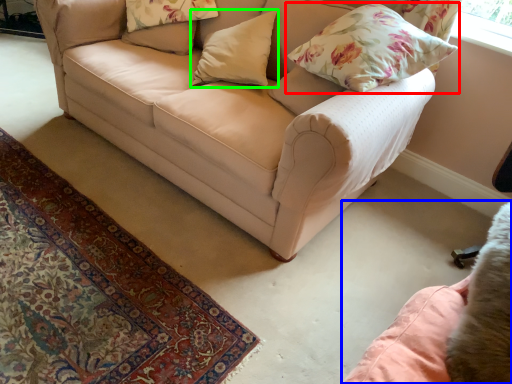
Question: Which object is positioned farthest from pillow (highlighted by a red box)? Select from swivel chair (highlighted by a blue box) and pillow (highlighted by a green box).

Choices:
 (A) swivel chair
 (B) pillow

Answer: (A)